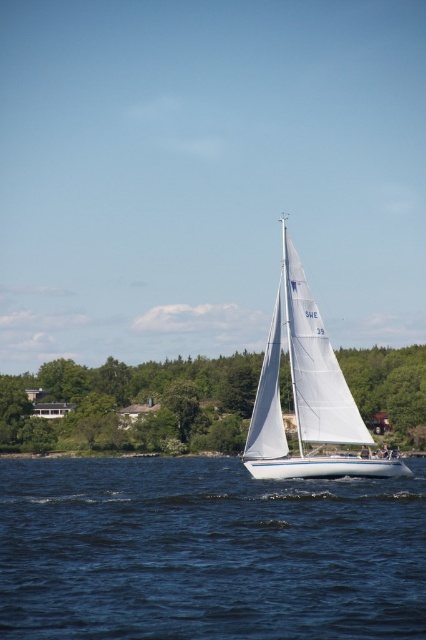
Who is shorter, blue water at center or green leafy tree at center?

blue water at center is shorter.

Which is behind, point (206, 492) or point (37, 378)?

Positioned behind is point (37, 378).

You are a GUI agent. You are given a task and a screenshot of the screen. Output one action in this format:
    pyautogui.click(x=<x>, y=<y>)
    Task: Click on the blue water at center
    
    Given the screenshot: What is the action you would take?
    pyautogui.click(x=207, y=552)

Can you confirm if blue water at center is smaller than white sailboat at center?

No, blue water at center is not smaller than white sailboat at center.

Does blue water at center appear on the right side of white sailboat at center?

In fact, blue water at center is to the left of white sailboat at center.

Does point (28, 481) come behind point (262, 476)?

Yes, point (28, 481) is behind point (262, 476).

The width and height of the screenshot is (426, 640). I want to click on blue water at center, so click(207, 552).

From the picture: Does green leafy tree at center have a lesser width compared to white sailboat at center?

Incorrect, green leafy tree at center's width is not less than white sailboat at center's.

Does green leafy tree at center have a lesser height compared to white sailboat at center?

Correct, green leafy tree at center is not as tall as white sailboat at center.

Who is more distant from viewer, (388, 387) or (282, 460)?

Positioned behind is point (388, 387).

This screenshot has width=426, height=640. What are the coordinates of `green leafy tree at center` in the screenshot? It's located at (126, 388).